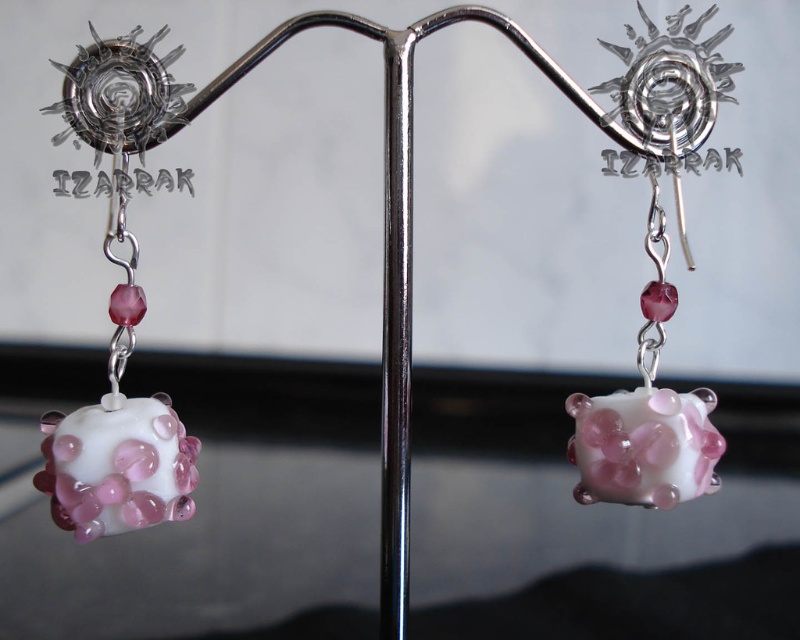
Question: Is translucent pink glass cube at center further to the viewer compared to polished metal pole at center?

Choices:
 (A) yes
 (B) no

Answer: (B)

Question: Observing the image, what is the correct spatial positioning of translucent pink glass cube at center in reference to polished metal pole at center?

Choices:
 (A) above
 (B) below

Answer: (A)

Question: Which point appears closest to the camera in this image?

Choices:
 (A) (574, 396)
 (B) (412, 180)
 (C) (64, 436)

Answer: (C)

Question: Which object is farther from the camera taking this photo?

Choices:
 (A) white glossy bead at center
 (B) translucent pink glass cube at center

Answer: (B)

Question: Considering the real-world distances, which object is farthest from the polished metal pole at center?

Choices:
 (A) white glossy bead at center
 (B) translucent pink glass cube at center

Answer: (A)

Question: Is white glossy bead at center bigger than translucent pink glass cube at center?

Choices:
 (A) yes
 (B) no

Answer: (B)